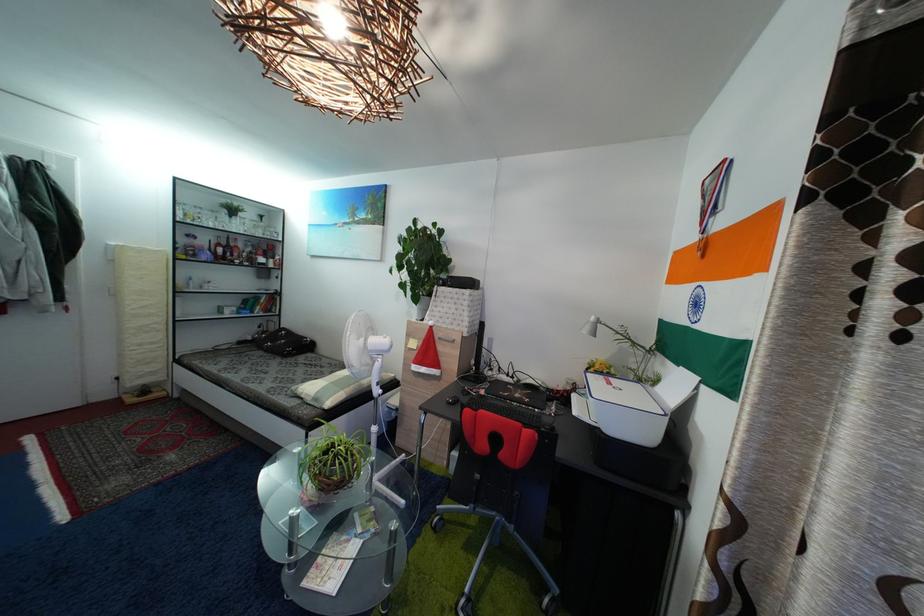
Image resolution: width=924 pixels, height=616 pixels. What do you see at coordinates (361, 345) in the screenshot?
I see `the white lamp head` at bounding box center [361, 345].